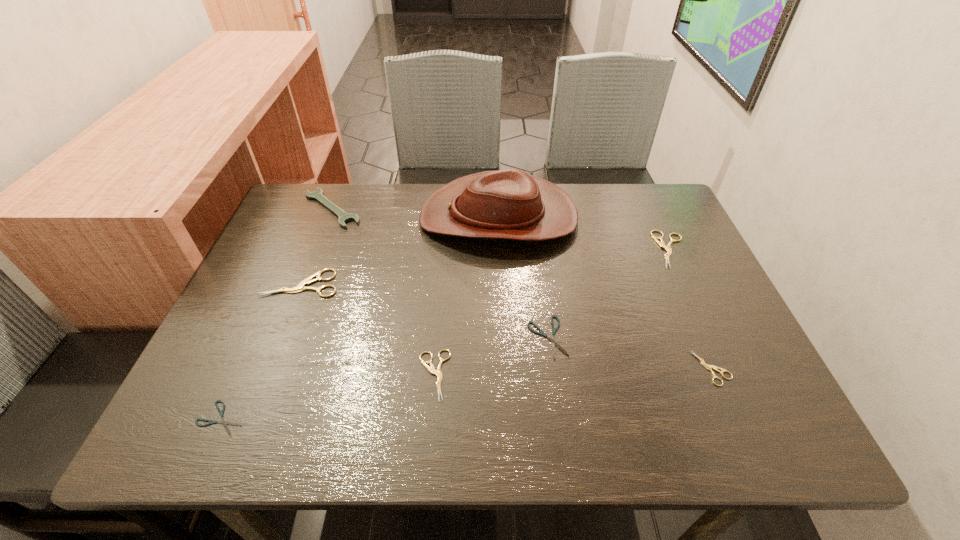
Find the location of a particular element. The width and height of the screenshot is (960, 540). vacant area situated on the right of the fifth tallest object is located at coordinates (535, 375).

Where is `vacant space situated 0.370m on the left of the smallest beige shears`? vacant space situated 0.370m on the left of the smallest beige shears is located at coordinates (513, 368).

At what (x,y) coordinates should I click in order to perform the action: click on blank space located 0.150m on the back of the fourth shears from left to right. Please return your answer as a coordinate pair (x, y). This screenshot has width=960, height=540. Looking at the image, I should click on (539, 270).

Locate an element on the screen. free space located on the right of the nearer black shears is located at coordinates [370, 418].

You are a GUI agent. You are given a task and a screenshot of the screen. Output one action in this format:
    pyautogui.click(x=<x>, y=<y>)
    Task: Click on the cowboy hat present at the far edge
    Image resolution: width=960 pixels, height=540 pixels.
    Given the screenshot: What is the action you would take?
    pyautogui.click(x=510, y=204)

Identify the location of wrench at the far edge. The width and height of the screenshot is (960, 540). (344, 217).

In order to click on shears at the far edge in this screenshot , I will do `click(661, 243)`.

Locate an element on the screen. The image size is (960, 540). wrench at the left edge is located at coordinates (344, 217).

Locate an element on the screen. Image resolution: width=960 pixels, height=540 pixels. object at the far left corner is located at coordinates (344, 217).

You are a GUI agent. You are given a task and a screenshot of the screen. Output one action in this format:
    pyautogui.click(x=<x>, y=<y>)
    Task: Click on the object at the near left corner
    This screenshot has width=960, height=540.
    Given the screenshot: What is the action you would take?
    pyautogui.click(x=222, y=421)